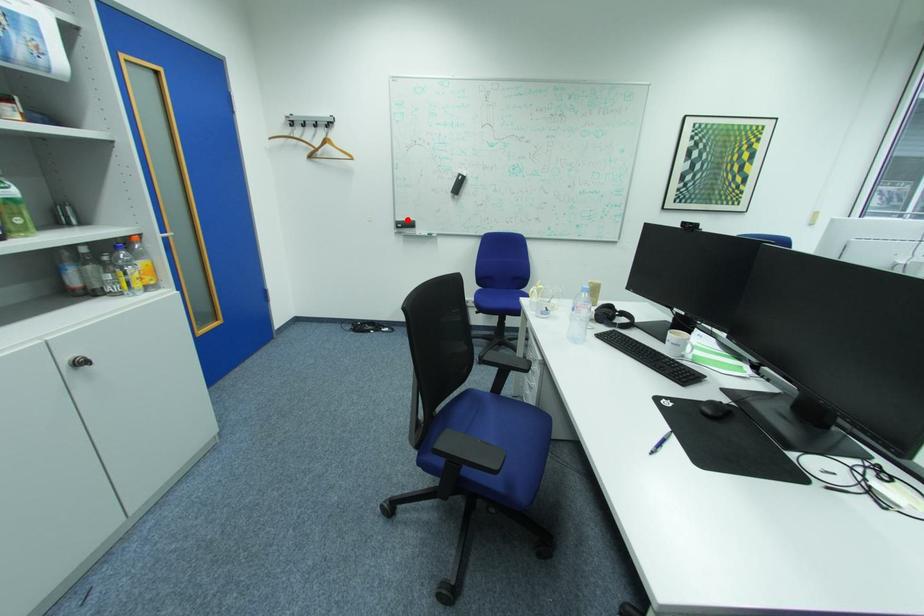
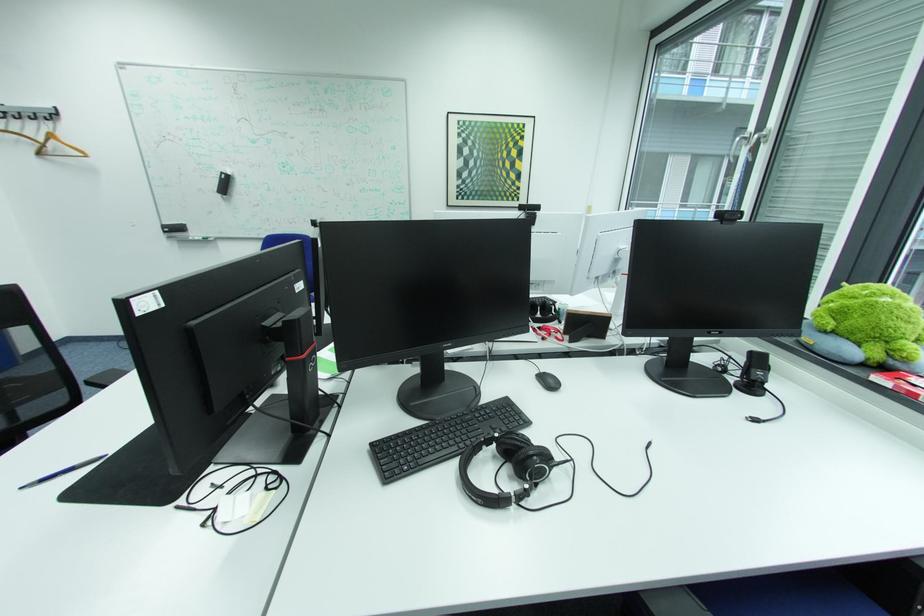
Question: I am providing you with two images of the same scene from different viewpoints. A red point is marked on the first image. At the location where the point appears in image 1, is it still visible in image 2?

Choices:
 (A) Yes
 (B) No

Answer: (A)